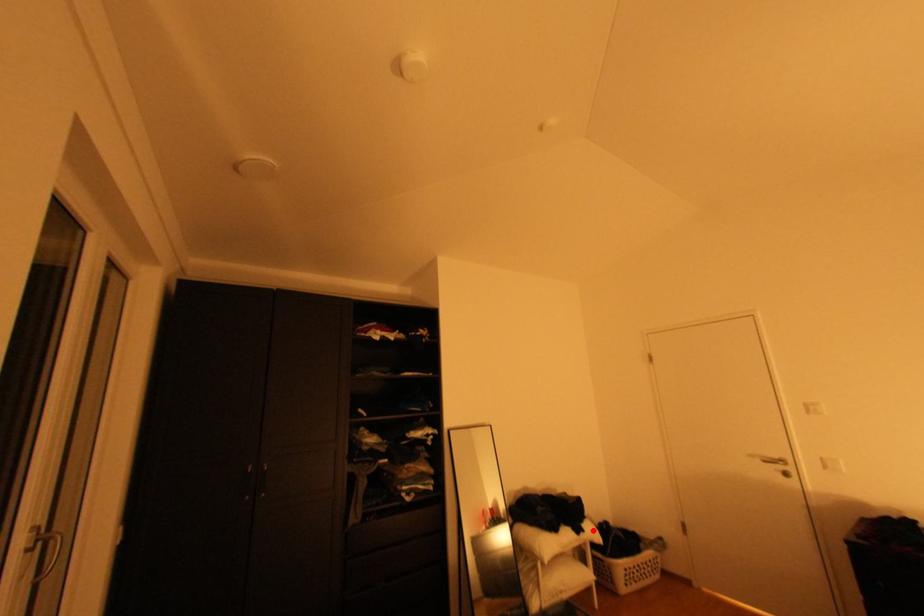
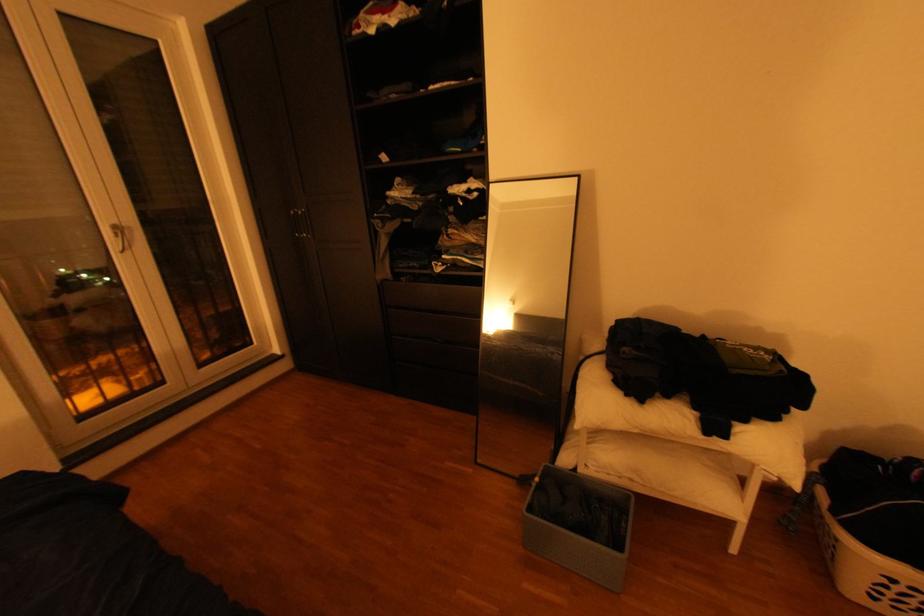
In the second image, find the point that corresponds to the highlighted location in the first image.

(735, 436)